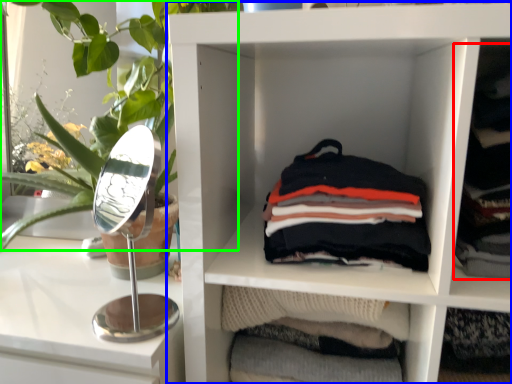
Question: Which object is positioned closest to clothing (highlighted by a red box)? Select from shelf (highlighted by a blue box) and plant (highlighted by a green box).

Choices:
 (A) shelf
 (B) plant

Answer: (A)